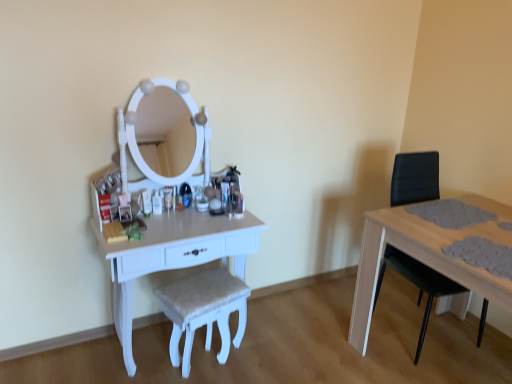
The height and width of the screenshot is (384, 512). In order to click on free point above white textured stool at center (from a real-world perspective) in this screenshot , I will do `click(203, 288)`.